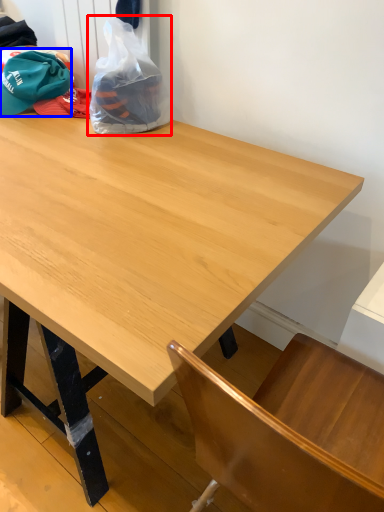
Question: Which point is closer to the camera, plastic bag (highlighted by a red box) or baseball hat (highlighted by a blue box)?

Choices:
 (A) plastic bag
 (B) baseball hat

Answer: (A)